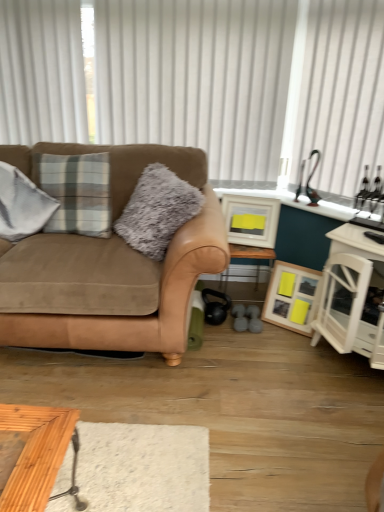
Question: Does wooden picture frame at lower right, which is counted as the 1th picture frame, starting from the bottom, have a lesser height compared to white wood cabinet at right?

Choices:
 (A) no
 (B) yes

Answer: (B)

Question: Does wooden picture frame at lower right, which is counted as the 1th picture frame, starting from the bottom, have a lesser width compared to white wood cabinet at right?

Choices:
 (A) yes
 (B) no

Answer: (A)

Question: From a real-world perspective, is wooden picture frame at lower right, which is counted as the 1th picture frame, starting from the bottom, below white wood cabinet at right?

Choices:
 (A) no
 (B) yes

Answer: (B)

Question: Is white wood cabinet at right a part of wooden picture frame at lower right, which ranks as the second picture frame in top-to-bottom order?

Choices:
 (A) no
 (B) yes

Answer: (A)

Question: Is wooden picture frame at lower right, which ranks as the second picture frame in top-to-bottom order, at the left side of white wood cabinet at right?

Choices:
 (A) no
 (B) yes

Answer: (B)

Question: Considering the positions of point (365, 146) and point (266, 222), is point (365, 146) closer or farther from the camera than point (266, 222)?

Choices:
 (A) farther
 (B) closer

Answer: (B)

Question: Considering the positions of white sheer curtain at upper right, marked as the second curtain in a left-to-right arrangement, and matte white picture frame at center, arranged as the second picture frame when ordered from the bottom, in the image, is white sheer curtain at upper right, marked as the second curtain in a left-to-right arrangement, bigger or smaller than matte white picture frame at center, arranged as the second picture frame when ordered from the bottom,?

Choices:
 (A) big
 (B) small

Answer: (A)

Question: From a real-world perspective, relative to matte white picture frame at center, arranged as the second picture frame when ordered from the bottom, is white sheer curtain at upper right, marked as the second curtain in a left-to-right arrangement, vertically above or below?

Choices:
 (A) below
 (B) above

Answer: (B)

Question: In the image, is white sheer curtain at upper right, the first curtain when ordered from right to left, on the left side or the right side of matte white picture frame at center, arranged as the second picture frame when ordered from the bottom?

Choices:
 (A) left
 (B) right

Answer: (B)

Question: Considering the positions of point (200, 160) and point (334, 327), is point (200, 160) closer or farther from the camera than point (334, 327)?

Choices:
 (A) closer
 (B) farther

Answer: (B)

Question: From a real-world perspective, is suede brown couch at left physically located above or below white wood cabinet at right?

Choices:
 (A) below
 (B) above

Answer: (B)

Question: In terms of size, does suede brown couch at left appear bigger or smaller than white wood cabinet at right?

Choices:
 (A) big
 (B) small

Answer: (A)

Question: From the image's perspective, relative to white wood cabinet at right, is suede brown couch at left above or below?

Choices:
 (A) above
 (B) below

Answer: (A)

Question: Considering the positions of white vertical blinds at upper center, which is the 2th curtain in right-to-left order, and white wood cabinet at right in the image, is white vertical blinds at upper center, which is the 2th curtain in right-to-left order, wider or thinner than white wood cabinet at right?

Choices:
 (A) wide
 (B) thin

Answer: (B)

Question: Is white vertical blinds at upper center, which appears as the first curtain when viewed from the left, bigger or smaller than white wood cabinet at right?

Choices:
 (A) big
 (B) small

Answer: (B)